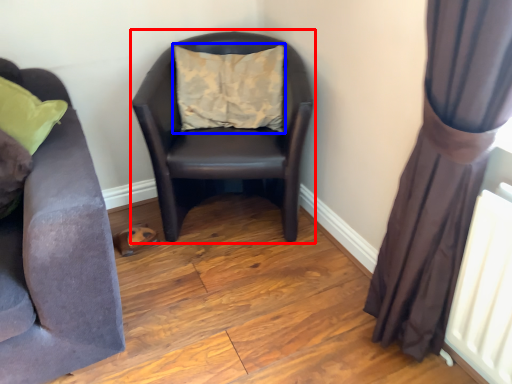
Question: Which object is closer to the camera taking this photo, rocking chair (highlighted by a red box) or pillow (highlighted by a blue box)?

Choices:
 (A) rocking chair
 (B) pillow

Answer: (A)